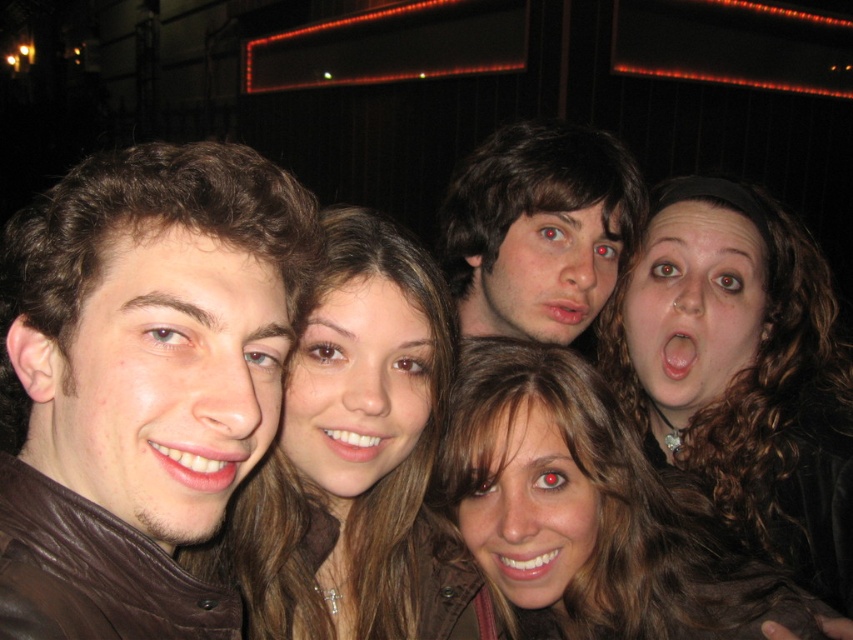
You are a photographer trying to adjust the lighting for a night photo. You have a spotlight that can only illuminate a circular area with a radius of 0.5 units. The center of the spotlight must be placed at the position of the smooth brown hair at center. Will the spotlight cover the entire group?

The spotlight has a radius of 0.5 units centered at the smooth brown hair at center located at point (357,461). Since the group is tightly posed together, the spotlight will likely cover them all within the radius.

Based on the scene description, can you determine if the brown curly hair at upper right is wider than the smooth brown hair at center?

The brown curly hair at upper right might be wider than smooth brown hair at center according to the description.

You are a photographer trying to adjust the lighting for a group photo. You notice the brown curly hair at upper right and the smooth brown hair at center. Which of these two hair styles is positioned higher in the image?

The brown curly hair at upper right is positioned higher in the image than the smooth brown hair at center.